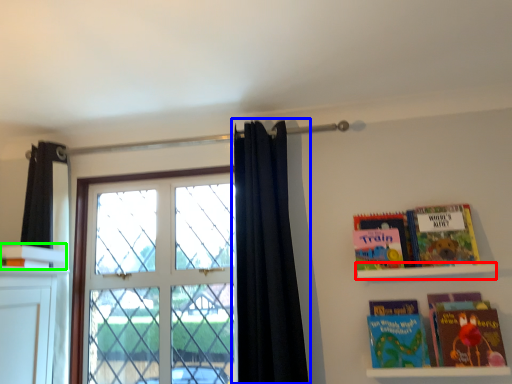
Question: Which is farther away from shelf (highlighted by a red box)? curtain (highlighted by a blue box) or book (highlighted by a green box)?

Choices:
 (A) curtain
 (B) book

Answer: (B)